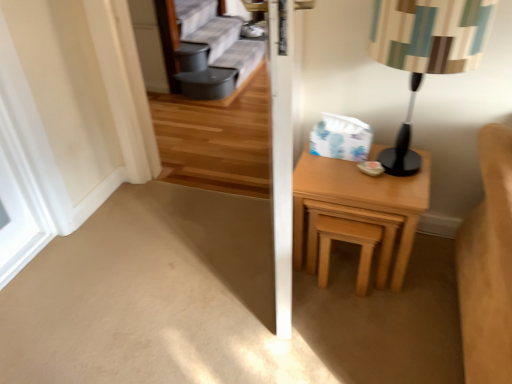
Question: Is light wood/texture nightstand at right oriented towards light brown wooden stool at right?

Choices:
 (A) no
 (B) yes

Answer: (B)

Question: From a real-world perspective, is light wood/texture nightstand at right physically below light brown wooden stool at right?

Choices:
 (A) yes
 (B) no

Answer: (B)

Question: From the image's perspective, does light wood/texture nightstand at right appear higher than light brown wooden stool at right?

Choices:
 (A) no
 (B) yes

Answer: (B)

Question: Is light wood/texture nightstand at right smaller than light brown wooden stool at right?

Choices:
 (A) no
 (B) yes

Answer: (A)

Question: Is light brown wooden stool at right a part of light wood/texture nightstand at right?

Choices:
 (A) yes
 (B) no

Answer: (A)

Question: Considering the positions of striped fabric lampshade at right and light brown wooden stool at right in the image, is striped fabric lampshade at right taller or shorter than light brown wooden stool at right?

Choices:
 (A) tall
 (B) short

Answer: (A)

Question: Considering their positions, is striped fabric lampshade at right located in front of or behind light brown wooden stool at right?

Choices:
 (A) behind
 (B) front

Answer: (B)

Question: Considering the positions of point (480, 29) and point (372, 233), is point (480, 29) closer or farther from the camera than point (372, 233)?

Choices:
 (A) farther
 (B) closer

Answer: (B)

Question: In terms of size, does striped fabric lampshade at right appear bigger or smaller than light brown wooden stool at right?

Choices:
 (A) small
 (B) big

Answer: (B)

Question: From the image's perspective, is light wood/texture nightstand at right positioned above or below striped fabric lampshade at right?

Choices:
 (A) below
 (B) above

Answer: (A)

Question: Is light wood/texture nightstand at right taller or shorter than striped fabric lampshade at right?

Choices:
 (A) tall
 (B) short

Answer: (B)

Question: Is light wood/texture nightstand at right wider or thinner than striped fabric lampshade at right?

Choices:
 (A) thin
 (B) wide

Answer: (B)

Question: Considering their positions, is light wood/texture nightstand at right located in front of or behind striped fabric lampshade at right?

Choices:
 (A) behind
 (B) front

Answer: (A)

Question: Is light wood/texture nightstand at right wider or thinner than white matte window at left?

Choices:
 (A) thin
 (B) wide

Answer: (B)

Question: Does point (411, 244) appear closer or farther from the camera than point (10, 147)?

Choices:
 (A) closer
 (B) farther

Answer: (A)